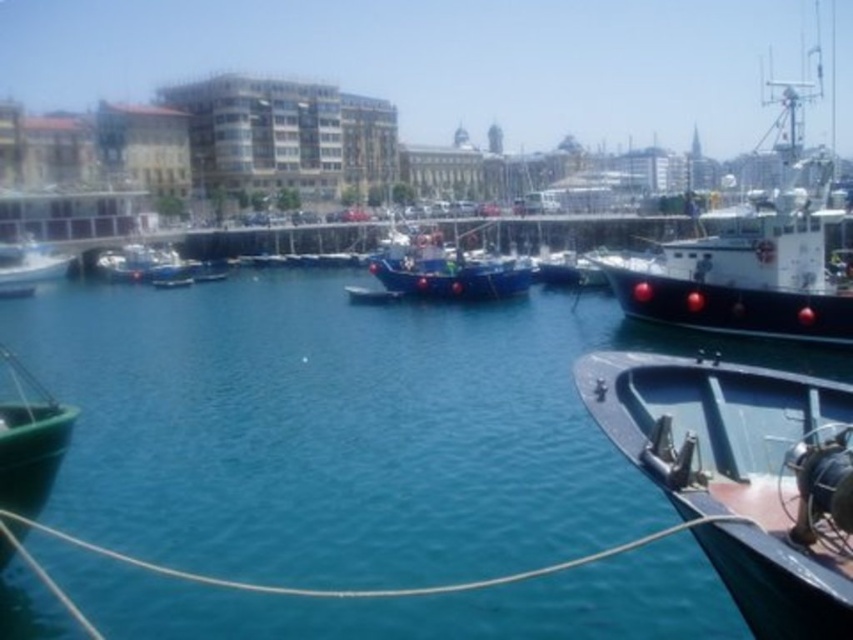
Question: Is shiny blue boat at lower right above white matte boat at right?

Choices:
 (A) yes
 (B) no

Answer: (B)

Question: Which point is closer to the camera?

Choices:
 (A) (700, 486)
 (B) (25, 250)
 (C) (164, 273)
 (D) (384, 292)

Answer: (A)

Question: Based on their relative distances, which object is nearer to the blue matte boat at left?

Choices:
 (A) blue matte boat at center
 (B) clear blue water at center
 (C) metallic blue boat at center

Answer: (B)

Question: Is white matte boat at right below blue matte boat at left?

Choices:
 (A) yes
 (B) no

Answer: (B)

Question: Can you confirm if shiny blue boat at lower right is positioned above metallic blue boat at center?

Choices:
 (A) no
 (B) yes

Answer: (A)

Question: Which of these objects is positioned closest to the clear blue water at center?

Choices:
 (A) blue matte boat at left
 (B) shiny blue boat at lower right
 (C) green matte boat at lower left

Answer: (B)